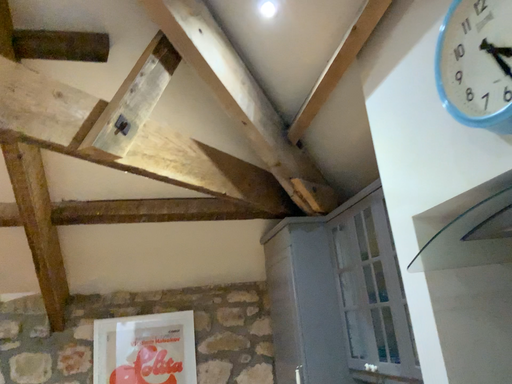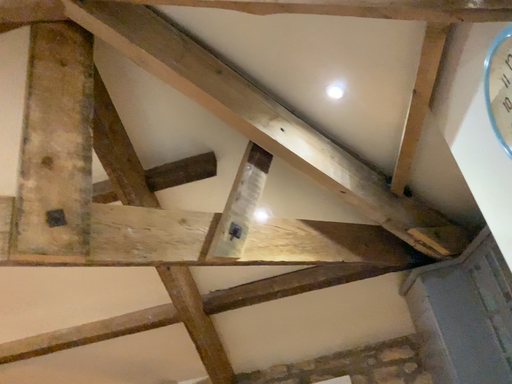
Question: How did the camera likely rotate when shooting the video?

Choices:
 (A) rotated right
 (B) rotated left

Answer: (B)